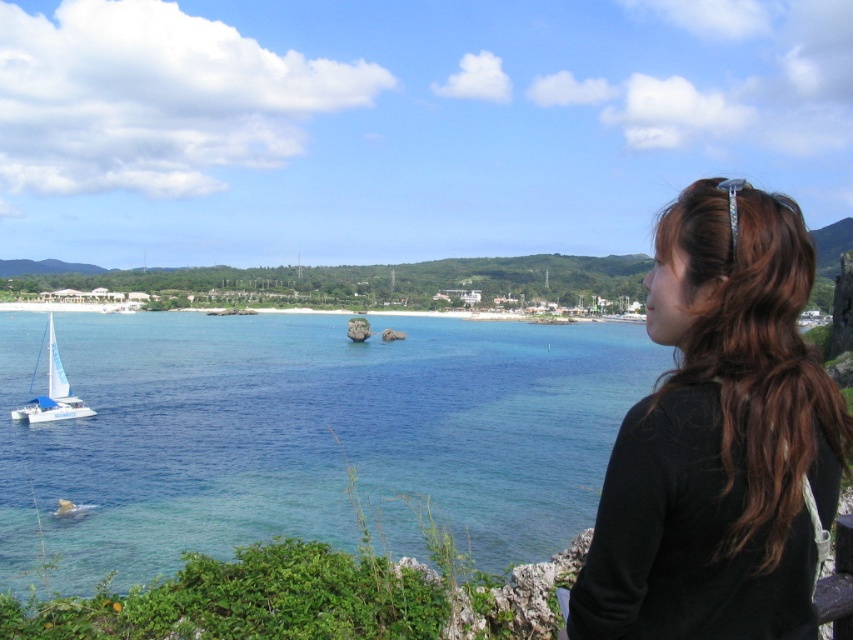
Who is more forward, (242, 513) or (30, 397)?

Point (242, 513)

Is clear blue water at center wider than white sailboat at lower left?

Yes, clear blue water at center is wider than white sailboat at lower left.

The height and width of the screenshot is (640, 853). I want to click on clear blue water at center, so click(305, 436).

In order to click on clear blue water at center in this screenshot , I will do `click(305, 436)`.

Can you confirm if brown hair at upper right is positioned above white sailboat at lower left?

Yes.

Is point (720, 524) in front of point (59, 397)?

Yes, it is.

The image size is (853, 640). What are the coordinates of `brown hair at upper right` in the screenshot? It's located at (718, 438).

You are a GUI agent. You are given a task and a screenshot of the screen. Output one action in this format:
    pyautogui.click(x=<x>, y=<y>)
    Task: Click on the brown hair at upper right
    
    Given the screenshot: What is the action you would take?
    pyautogui.click(x=718, y=438)

What do you see at coordinates (305, 436) in the screenshot? I see `clear blue water at center` at bounding box center [305, 436].

Which is behind, point (584, 360) or point (607, 465)?

Point (584, 360)

Find the location of a particular element. clear blue water at center is located at coordinates (305, 436).